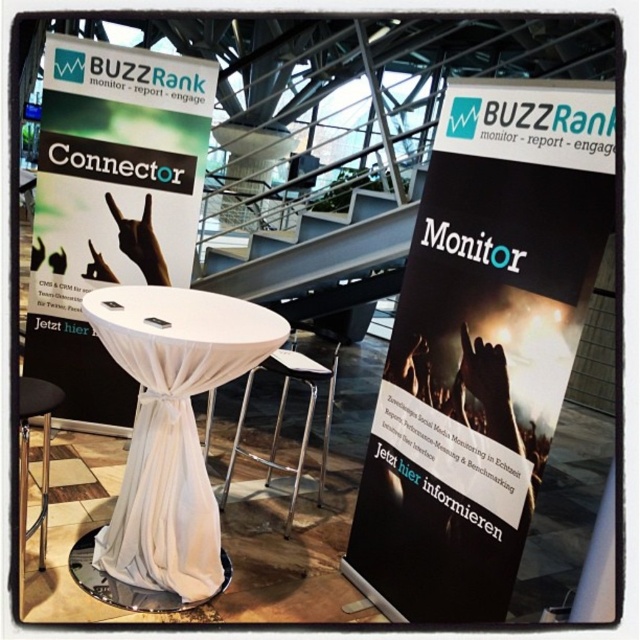
You are a person with a height of 1.75 meters standing at the point marked as point(576,157). Can you reach the top of the banner that says BUZZRank?

The distance between you and the banner is 1.83 meters. Since you are 1.75 meters tall, you cannot reach the top of the banner that says BUZZRank as it is slightly taller than your height.

You are organizing a conference and need to place a decorative centerpiece on the table. The centerpiece requires a space wider than the black metal stool at lower left. Can the black paper at left accommodate this requirement?

The black paper at left might be wider than the black metal stool at lower left, so it could potentially accommodate the centerpiece if its width meets the requirement.

You are organizing a conference and need to place a 1.2 meter tall standee between the black paper at left and the black metal stool at lower left. Can the standee fit vertically between them?

The black paper at left is taller than the black metal stool at lower left. However, the exact height difference isn not specified, so it is uncertain whether the 1.2 meter standee can fit vertically between them.